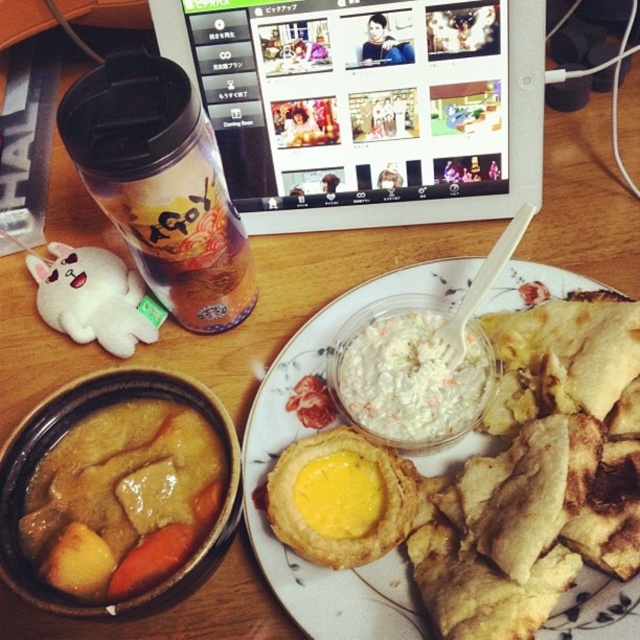
Question: Which is farther from the white plastic tablet at upper center?

Choices:
 (A) white matte plate at center
 (B) yellow fried egg at center

Answer: (B)

Question: Estimate the real-world distances between objects in this image. Which object is closer to the golden brown curry at plate center?

Choices:
 (A) white creamy dip at center
 (B) white matte plate at center

Answer: (B)

Question: Which point appears closest to the camera in this image?

Choices:
 (A) (355, 416)
 (B) (496, 289)

Answer: (A)

Question: Is golden brown curry at plate center above yellow fried egg at center?

Choices:
 (A) yes
 (B) no

Answer: (A)

Question: Can you confirm if white matte plate at center is thinner than white creamy dip at center?

Choices:
 (A) no
 (B) yes

Answer: (A)

Question: Does white plastic tablet at upper center appear under white creamy dip at center?

Choices:
 (A) no
 (B) yes

Answer: (A)